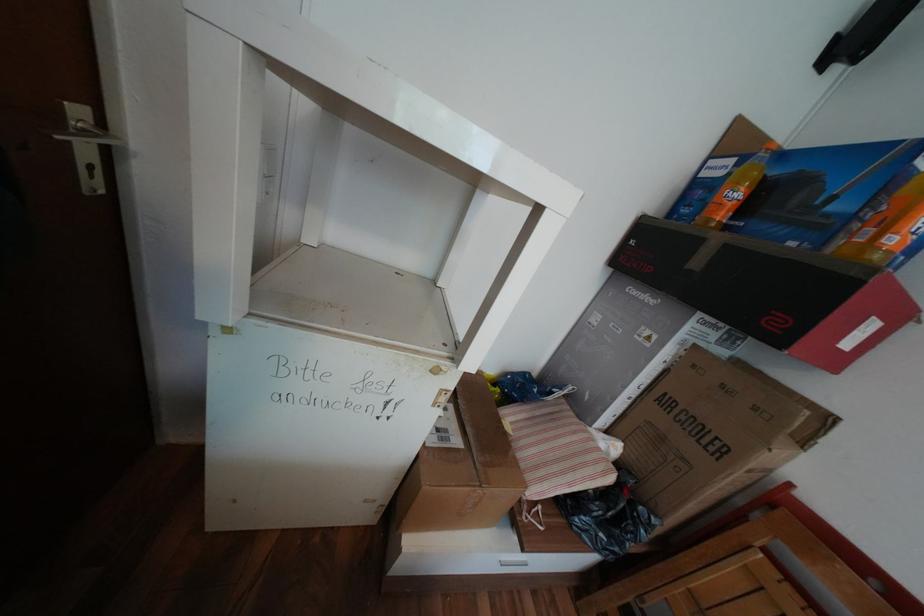
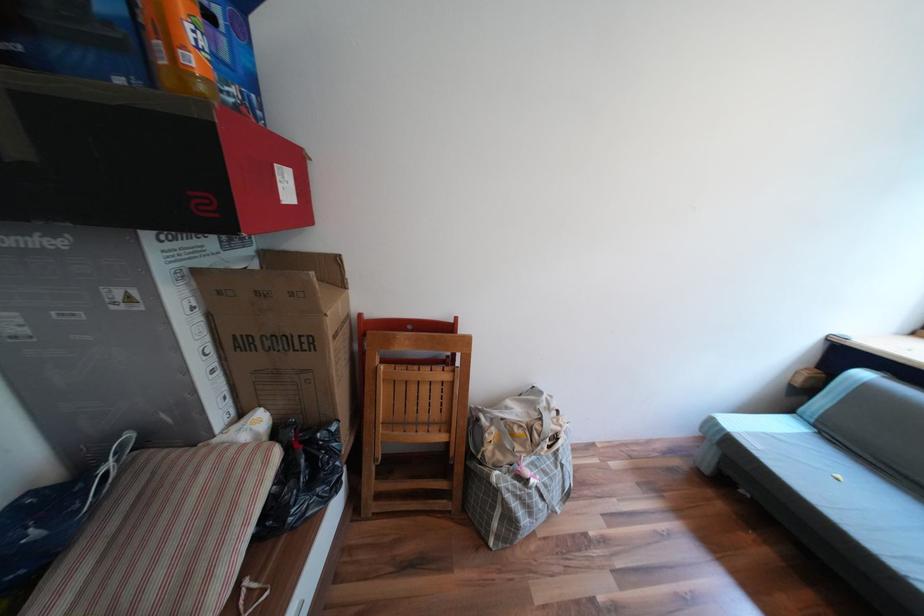
Locate, in the second image, the point that corresponds to (x=651, y=387) in the first image.

(219, 349)